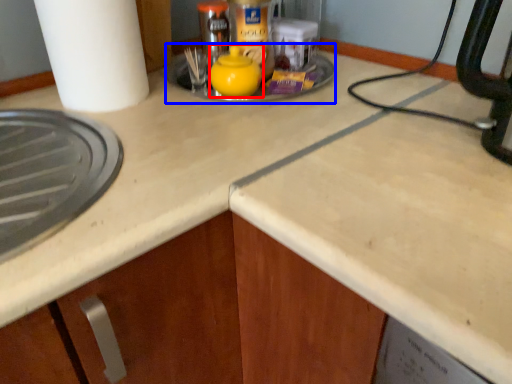
Question: Which of the following is the farthest to the observer, tea pot (highlighted by a red box) or sink (highlighted by a blue box)?

Choices:
 (A) tea pot
 (B) sink

Answer: (B)